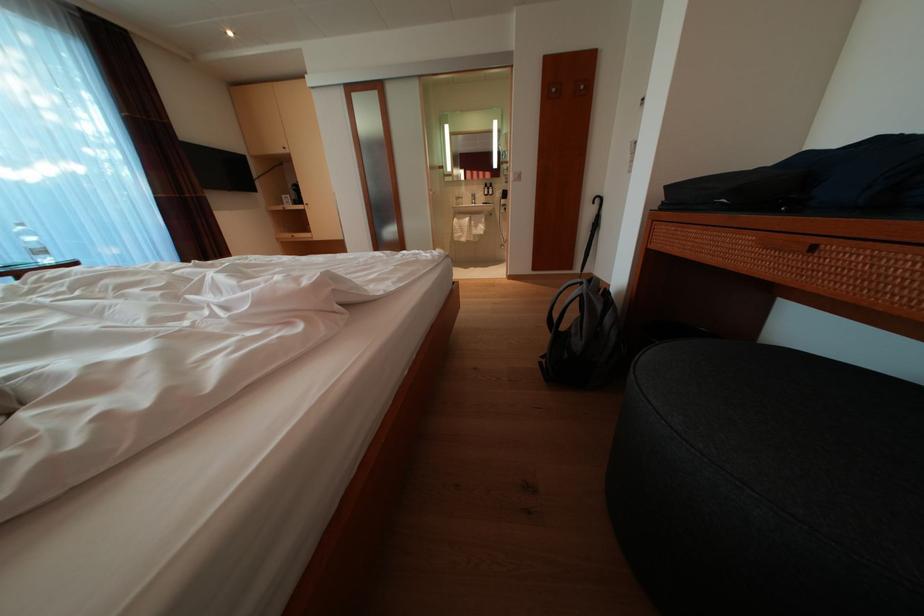
The image size is (924, 616). In order to click on faucet handle in this screenshot , I will do `click(472, 198)`.